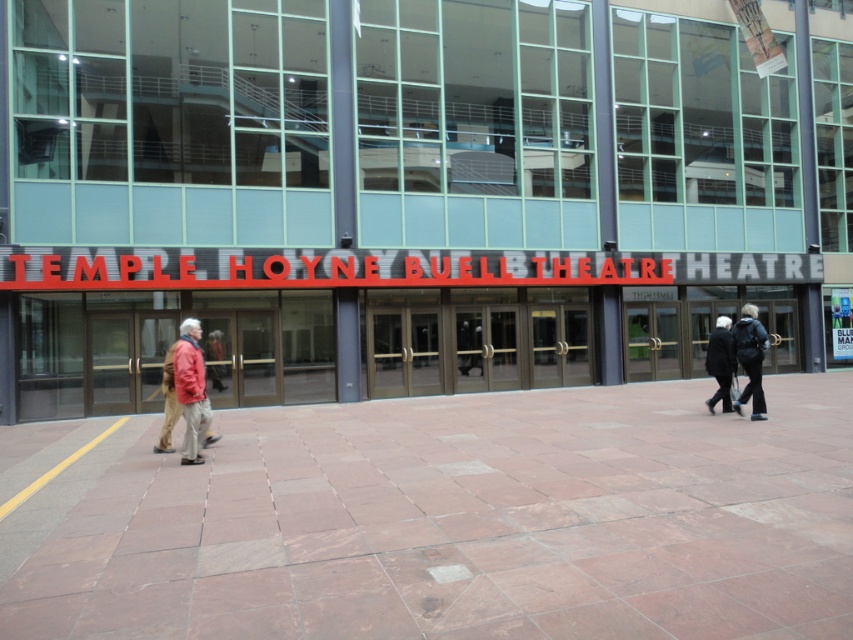
You are standing in front of the Temple Hoyne Buell Theatre and see the brown stone pavement at center and the red jacket at left. Which object is closer to the entrance of the theatre?

The red jacket at left is closer to the entrance of the Temple Hoyne Buell Theatre because the brown stone pavement at center is located below it, meaning the jacket is positioned higher up and nearer to the entrance area.

You are a delivery person trying to navigate through the Temple Hoyne Buell Theatre entrance. You see a black leather jacket at center and a black wool coat at center. Can you walk between them without stepping on either?

The black leather jacket at center and black wool coat at center are 14.48 inches apart, which is less than the typical 18 inches required for a person to walk between objects without stepping on them. Therefore, you cannot walk between them without stepping on either.